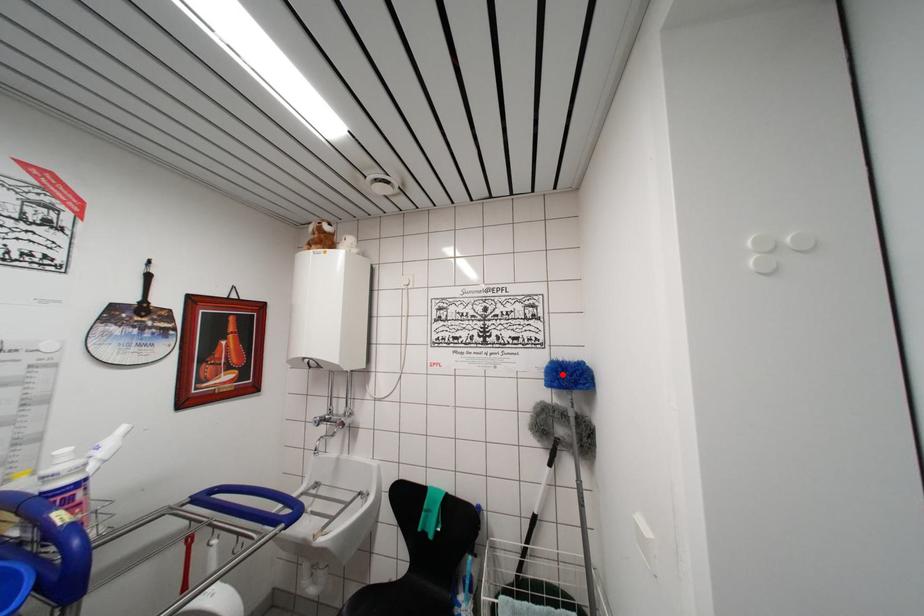
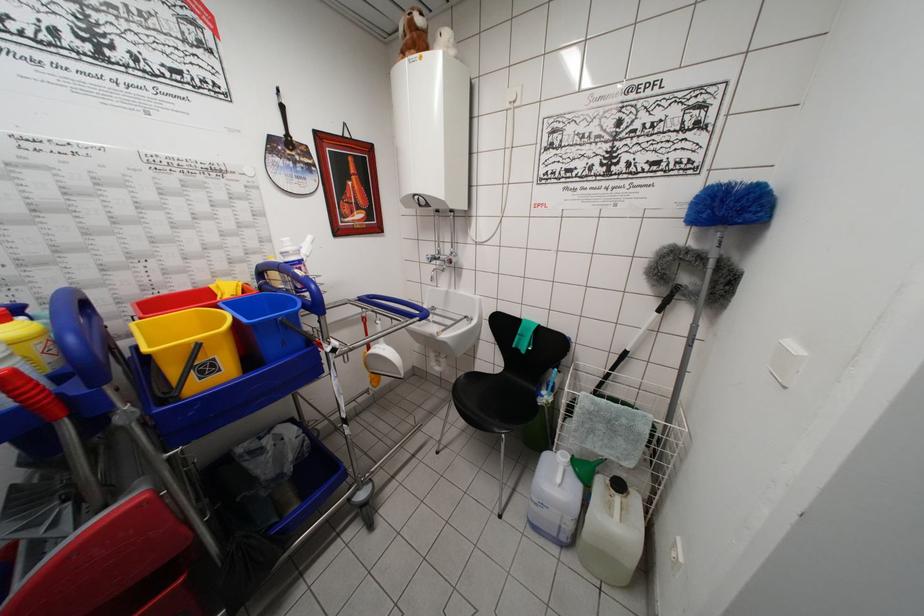
In the second image, find the point that corresponds to the highlighted location in the first image.

(723, 199)